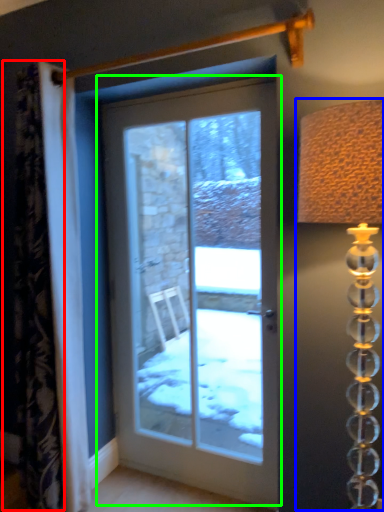
Question: Which is nearer to the curtain (highlighted by a red box)? table lamp (highlighted by a blue box) or door (highlighted by a green box).

Choices:
 (A) table lamp
 (B) door

Answer: (A)